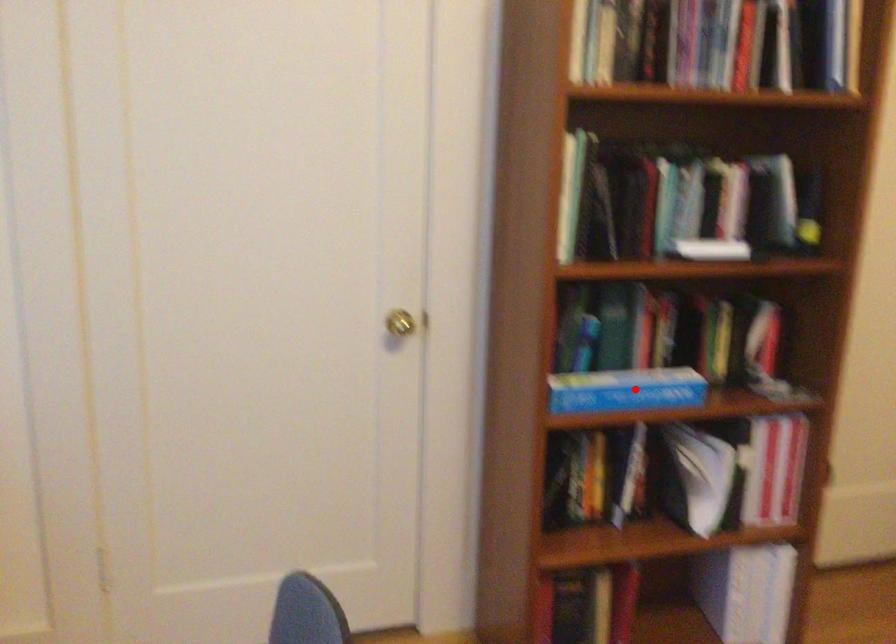
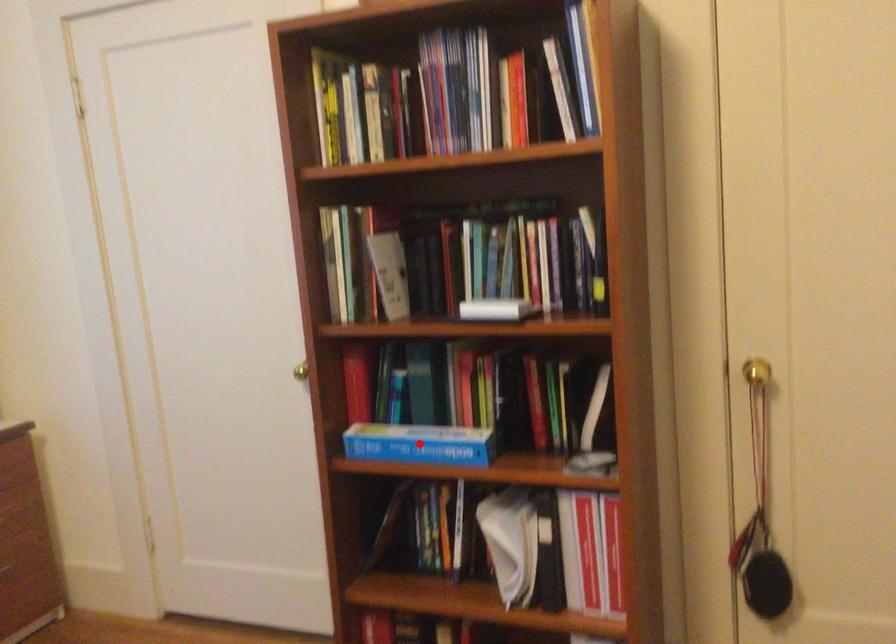
I am providing you with two images of the same scene from different viewpoints. A red point is marked on the first image and another point is marked on the second image. Is the marked point in image1 the same physical position as the marked point in image2?

Yes